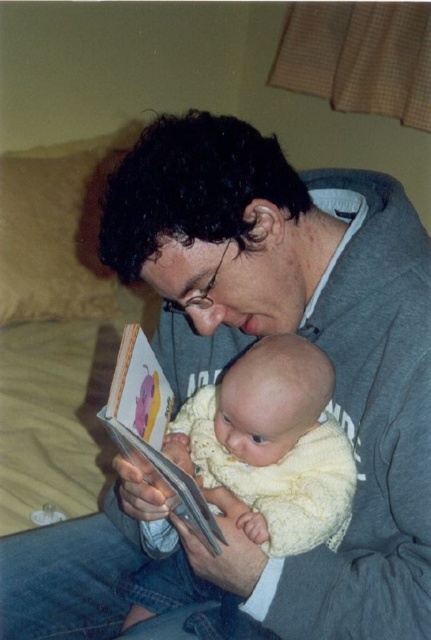
Question: Among these points, which one is nearest to the camera?

Choices:
 (A) (164, 397)
 (B) (252, 426)

Answer: (B)

Question: Is soft yellow knit at center positioned behind hardcover book at center?

Choices:
 (A) no
 (B) yes

Answer: (B)

Question: Can you confirm if soft yellow knit at center is smaller than hardcover book at center?

Choices:
 (A) no
 (B) yes

Answer: (A)

Question: Is soft yellow knit at center to the left of hardcover book at center from the viewer's perspective?

Choices:
 (A) no
 (B) yes

Answer: (A)

Question: Which object appears farthest from the camera in this image?

Choices:
 (A) soft yellow knit at center
 (B) hardcover book at center

Answer: (A)

Question: Which point is farther to the camera?

Choices:
 (A) hardcover book at center
 (B) soft yellow knit at center

Answer: (B)